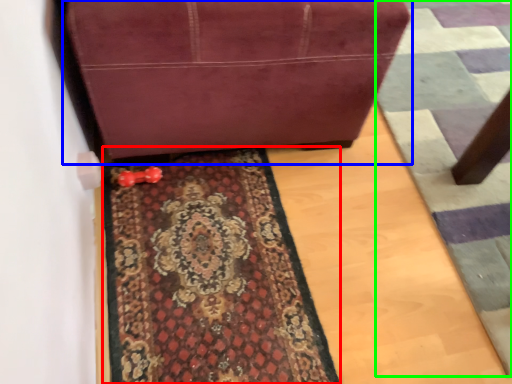
Question: Which is farther away from mat (highlighted by a red box)? furniture (highlighted by a blue box) or doormat (highlighted by a green box)?

Choices:
 (A) furniture
 (B) doormat

Answer: (B)